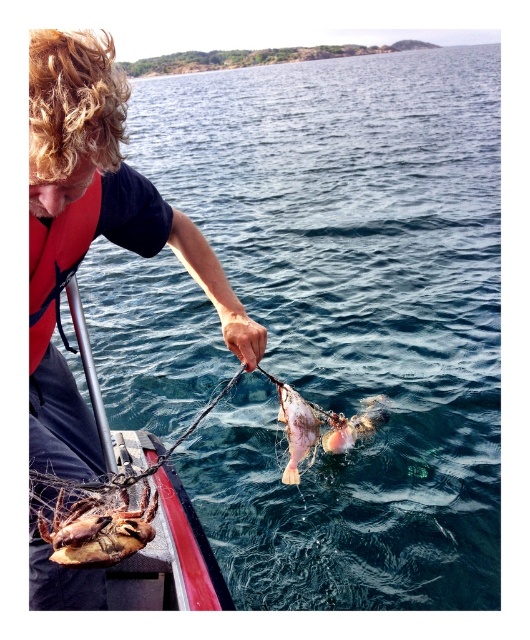
Based on the photo, you are a safety inspector reviewing this fishing scene. The safety regulations require that the life vest must be worn by the fisher. Based on the coordinates provided in the Objects Description, is the matte orange life vest at left positioned correctly on the fisher?

The matte orange life vest at left is positioned at coordinates point (93, 230), which indicates it is placed on the fisher as required by safety regulations.

You are a photographer trying to capture the fisherman and the two points mentioned in the scene. Which point, point (144, 604) or point (64, 552), will appear closer to the camera in your photo?

Point (144, 604) will appear closer to the camera in the photo because it is further to the camera than point (64, 552) according to the description.